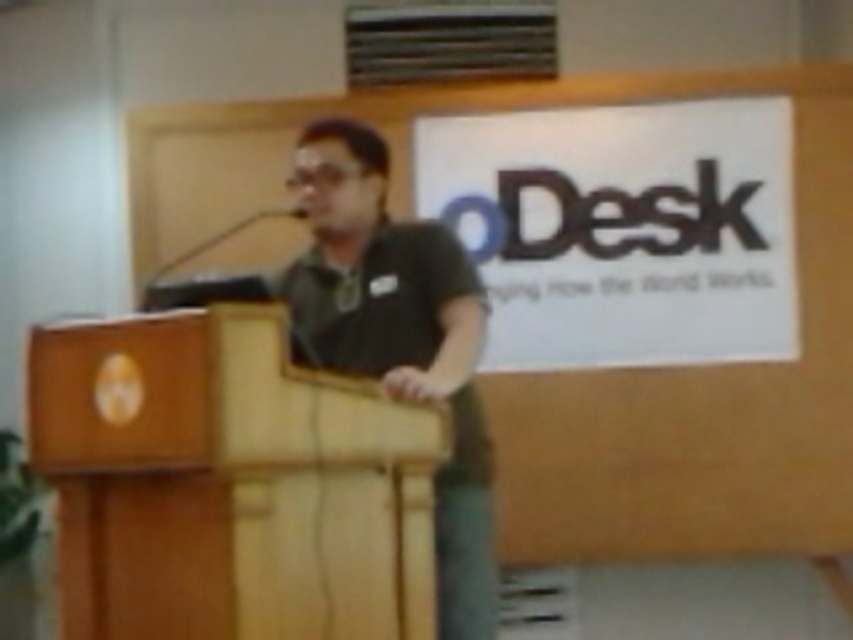
Can you confirm if wooden podium at center is bigger than black matte shirt at center?

Incorrect, wooden podium at center is not larger than black matte shirt at center.

Is wooden podium at center thinner than black matte shirt at center?

No, wooden podium at center is not thinner than black matte shirt at center.

The image size is (853, 640). I want to click on wooden podium at center, so click(229, 483).